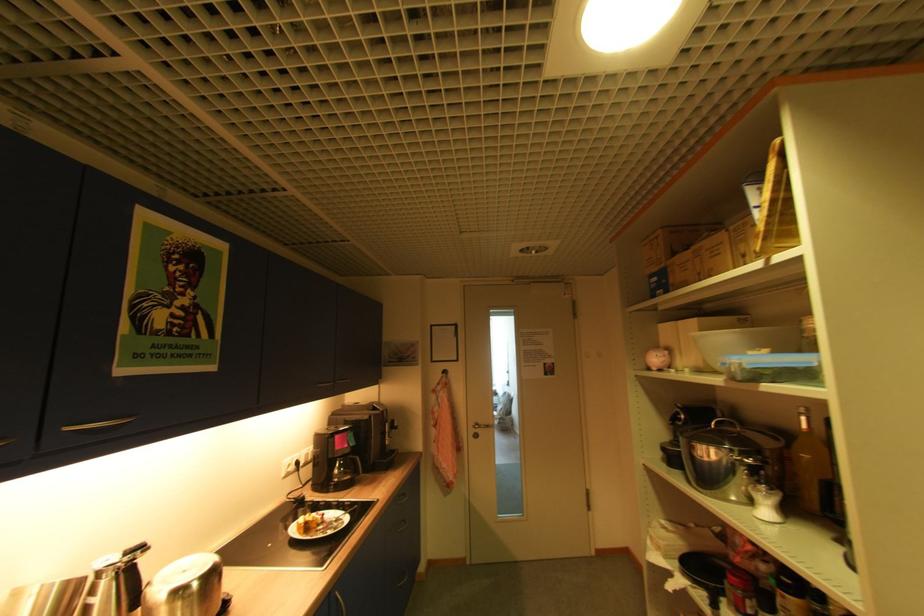
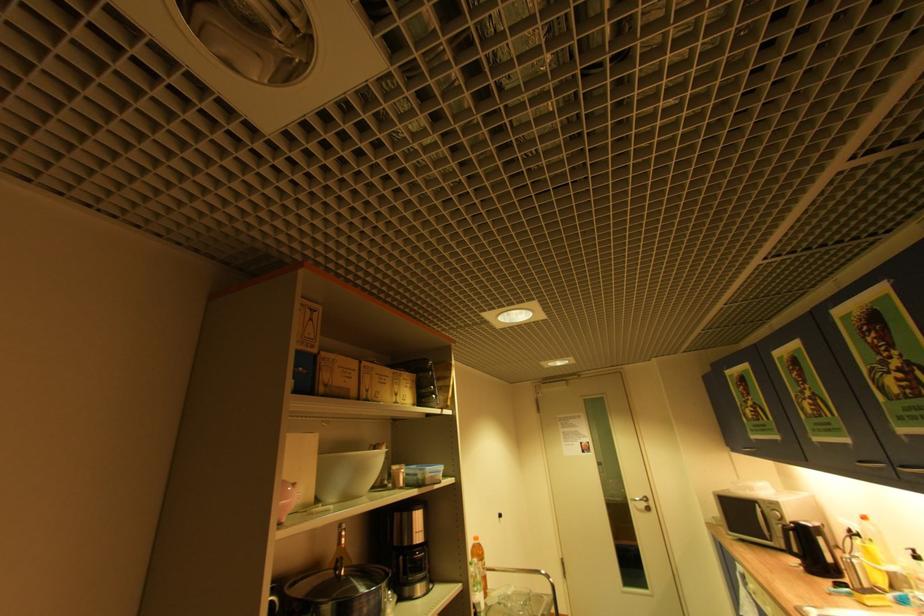
Locate, in the second image, the point that corresponds to (x=723, y=246) in the first image.

(391, 378)